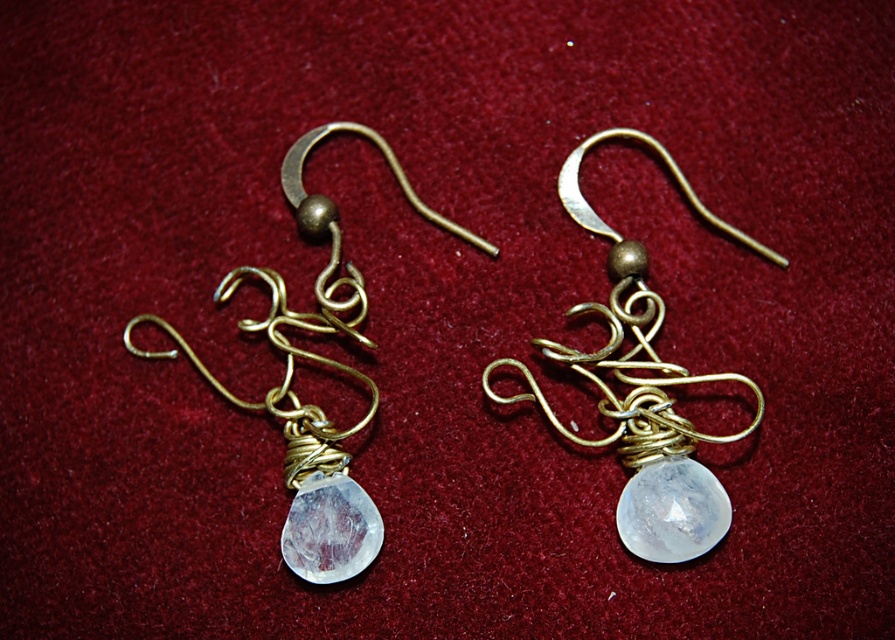
You are an appraiser examining the earrings. You notice two matte gold wire sections in the design. According to the image, which matte gold wire is closer to you, the matte gold wire at center or the matte gold wire at left?

The matte gold wire at center is closer to you because it is positioned over the matte gold wire at left.